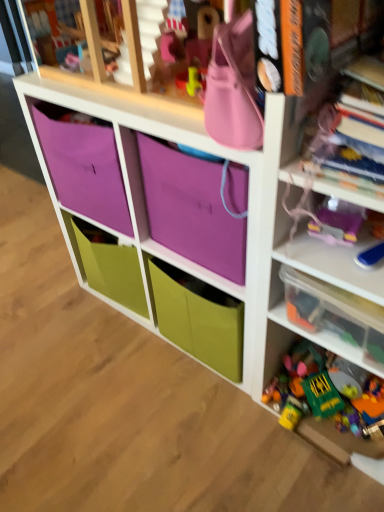
What are the coordinates of `blank space to the left of purple fabric storage at center` in the screenshot? It's located at (54, 323).